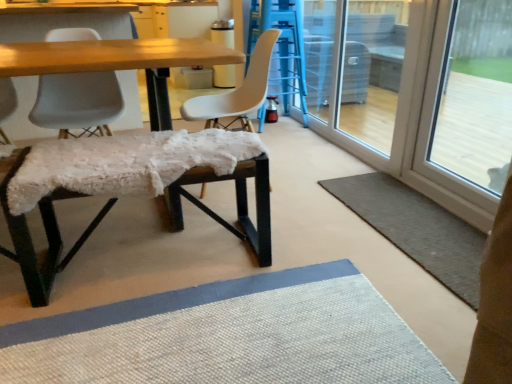
This screenshot has height=384, width=512. What do you see at coordinates (118, 62) in the screenshot? I see `wooden table at center` at bounding box center [118, 62].

Measure the distance between point [257,81] and camera.

They are 6.98 feet apart.

This screenshot has width=512, height=384. I want to click on white matte chair at center, which is counted as the second chair, starting from the left, so click(237, 92).

In order to face transparent glass door at right, should I rotate leftwards or rightwards?

A 27.451 degree turn to the right will do.

Measure the distance between point [110,93] and camera.

The distance of point [110,93] from camera is 2.37 meters.

What is the approximate width of transparent glass screen door at right?

It is 9.49 inches.

Where is `matte blue bar stool at center, arranged as the second bar stool when viewed from the front`? The width and height of the screenshot is (512, 384). matte blue bar stool at center, arranged as the second bar stool when viewed from the front is located at coordinates (281, 48).

This screenshot has height=384, width=512. In order to click on gray textured rug at lower right in this screenshot , I will do `click(416, 229)`.

Which object is further away from the camera, white matte chair at center, which is counted as the second chair, starting from the left, or white textured bench at lower left, which is the 1th chair in left-to-right order?

white textured bench at lower left, which is the 1th chair in left-to-right order.

Considering the positions of points (220, 126) and (76, 76), is point (220, 126) closer to camera compared to point (76, 76)?

Yes, point (220, 126) is in front of point (76, 76).

The width and height of the screenshot is (512, 384). In order to click on chair on the right of white textured bench at lower left, the second chair in the right-to-left sequence in this screenshot , I will do `click(237, 92)`.

Who is taller, white textured bench at lower left, the second chair in the right-to-left sequence, or matte blue bar stool at center, which is the 1th bar stool in right-to-left order?

matte blue bar stool at center, which is the 1th bar stool in right-to-left order.

Does point (104, 72) come in front of point (267, 12)?

Yes, it is.

Where is `bar stool behind the white textured bench at lower left, which is the 1th chair in left-to-right order`? The image size is (512, 384). bar stool behind the white textured bench at lower left, which is the 1th chair in left-to-right order is located at coordinates (281, 48).

Is white textured bench at lower left, the second chair in the right-to-left sequence, wider than matte blue bar stool at center, the 1th bar stool in the back-to-front sequence?

Correct, the width of white textured bench at lower left, the second chair in the right-to-left sequence, exceeds that of matte blue bar stool at center, the 1th bar stool in the back-to-front sequence.

Between white textured bench at lower left, which is the 1th chair in left-to-right order, and transparent glass door at right, which one has more height?

transparent glass door at right is taller.

Does white textured bench at lower left, the second chair in the right-to-left sequence, have a greater width compared to transparent glass door at right?

Correct, the width of white textured bench at lower left, the second chair in the right-to-left sequence, exceeds that of transparent glass door at right.

Considering the positions of objects white textured bench at lower left, which is the 1th chair in left-to-right order, and transparent glass door at right in the image provided, who is behind, white textured bench at lower left, which is the 1th chair in left-to-right order, or transparent glass door at right?

Positioned behind is white textured bench at lower left, which is the 1th chair in left-to-right order.

The height and width of the screenshot is (384, 512). Find the location of `chair in front of the white textured bench at lower left, the second chair in the right-to-left sequence`. chair in front of the white textured bench at lower left, the second chair in the right-to-left sequence is located at coordinates (237, 92).

Considering the relative sizes of white textured bench at lower left, the second chair in the right-to-left sequence, and white matte chair at center, which is the 1th chair in right-to-left order, in the image provided, is white textured bench at lower left, the second chair in the right-to-left sequence, bigger than white matte chair at center, which is the 1th chair in right-to-left order,?

No.

Between point (42, 103) and point (227, 98), which one is positioned in front?

Positioned in front is point (42, 103).

Which is more to the left, white textured bench at lower left, which is the 1th chair in left-to-right order, or white matte chair at center, which is the 1th chair in right-to-left order?

white textured bench at lower left, which is the 1th chair in left-to-right order, is more to the left.

In terms of height, does white textured bench at lower left, the second chair in the right-to-left sequence, look taller or shorter compared to transparent glass screen door at right?

Considering their sizes, white textured bench at lower left, the second chair in the right-to-left sequence, has less height than transparent glass screen door at right.

I want to click on screen door located above the white textured bench at lower left, the second chair in the right-to-left sequence (from the image's perspective), so click(x=356, y=67).

Which object is thinner, white textured bench at lower left, the second chair in the right-to-left sequence, or transparent glass screen door at right?

With smaller width is transparent glass screen door at right.

How much distance is there between white textured bench at lower left, which is the 1th chair in left-to-right order, and transparent glass screen door at right?

white textured bench at lower left, which is the 1th chair in left-to-right order, and transparent glass screen door at right are 6.85 feet apart.

Is the surface of matte blue bar stool at center, which appears as the 2th bar stool when viewed from the left, in direct contact with transparent glass screen door at right?

matte blue bar stool at center, which appears as the 2th bar stool when viewed from the left, and transparent glass screen door at right are not in contact.

Who is taller, matte blue bar stool at center, the second bar stool positioned from the bottom, or transparent glass screen door at right?

Standing taller between the two is matte blue bar stool at center, the second bar stool positioned from the bottom.

Is the position of matte blue bar stool at center, which is the 1th bar stool in right-to-left order, more distant than that of transparent glass screen door at right?

Yes, it is.

Considering the sizes of objects matte blue bar stool at center, the 1th bar stool in the back-to-front sequence, and transparent glass screen door at right in the image provided, who is thinner, matte blue bar stool at center, the 1th bar stool in the back-to-front sequence, or transparent glass screen door at right?

transparent glass screen door at right.

Which is closer, (202, 106) or (357, 131)?

The point (202, 106) is closer.

Which is more to the left, white matte chair at center, which is the 1th chair in right-to-left order, or transparent glass screen door at right?

white matte chair at center, which is the 1th chair in right-to-left order.

From a real-world perspective, is white matte chair at center, which is counted as the second chair, starting from the left, physically located above or below transparent glass screen door at right?

white matte chair at center, which is counted as the second chair, starting from the left, is situated lower than transparent glass screen door at right in the real world.

Is white matte chair at center, which is counted as the second chair, starting from the left, beside transparent glass screen door at right?

No, white matte chair at center, which is counted as the second chair, starting from the left, is not beside transparent glass screen door at right.

At what (x,y) coordinates should I click in order to perform the action: click on chair below the white textured bench at lower left, which is the 1th chair in left-to-right order (from the image's perspective). Please return your answer as a coordinate pair (x, y). The height and width of the screenshot is (384, 512). Looking at the image, I should click on (237, 92).

Image resolution: width=512 pixels, height=384 pixels. I want to click on bar stool behind the white textured bench at lower left, the second chair in the right-to-left sequence, so click(281, 48).

Based on their spatial positions, is white textured bench at lower left, which is the 1th chair in left-to-right order, or matte blue bar stool at center, the second bar stool positioned from the bottom, further from wooden table at center?

Based on the image, matte blue bar stool at center, the second bar stool positioned from the bottom, appears to be further to wooden table at center.

Estimate the real-world distances between objects in this image. Which object is closer to transparent glass door at right, white matte chair at center, which is counted as the second chair, starting from the left, or wooden table at center?

white matte chair at center, which is counted as the second chair, starting from the left, lies closer to transparent glass door at right than the other object.

Which object lies further to the anchor point transparent glass screen door at right, fuzzy fabric bench at center, the second bar stool positioned from the right, or white textured bench at lower left, the second chair in the right-to-left sequence?

white textured bench at lower left, the second chair in the right-to-left sequence, is positioned further to the anchor transparent glass screen door at right.

Based on their spatial positions, is matte blue bar stool at center, which appears as the 2th bar stool when viewed from the left, or white matte chair at center, which is the 1th chair in right-to-left order, closer to wooden table at center?

white matte chair at center, which is the 1th chair in right-to-left order, is positioned closer to the anchor wooden table at center.

Looking at the image, which one is located closer to fuzzy fabric bench at center, which is the first bar stool in bottom-to-top order, gray textured rug at lower right or white textured bench at lower left, which is the 1th chair in left-to-right order?

white textured bench at lower left, which is the 1th chair in left-to-right order, is positioned closer to the anchor fuzzy fabric bench at center, which is the first bar stool in bottom-to-top order.

Based on the photo, when comparing their distances from matte blue bar stool at center, which appears as the 2th bar stool when viewed from the left, does white matte chair at center, which is the 1th chair in right-to-left order, or gray textured rug at lower right seem closer?

Based on the image, white matte chair at center, which is the 1th chair in right-to-left order, appears to be nearer to matte blue bar stool at center, which appears as the 2th bar stool when viewed from the left.

Estimate the real-world distances between objects in this image. Which object is further from wooden table at center, transparent glass screen door at right or white matte chair at center, which is the 1th chair in right-to-left order?

transparent glass screen door at right.

Estimate the real-world distances between objects in this image. Which object is further from white matte chair at center, which is the 1th chair in right-to-left order, gray textured rug at lower right or white textured bench at lower left, which is the 1th chair in left-to-right order?

Based on the image, gray textured rug at lower right appears to be further to white matte chair at center, which is the 1th chair in right-to-left order.

The image size is (512, 384). I want to click on screen door located between wooden table at center and gray textured rug at lower right in the left-right direction, so click(x=356, y=67).

Image resolution: width=512 pixels, height=384 pixels. Find the location of `window screen between gray textured rug at lower right and matte blue bar stool at center, which is the 1th bar stool from top to bottom, from front to back`. window screen between gray textured rug at lower right and matte blue bar stool at center, which is the 1th bar stool from top to bottom, from front to back is located at coordinates (477, 95).

The height and width of the screenshot is (384, 512). Identify the location of screen door between white textured bench at lower left, the second chair in the right-to-left sequence, and transparent glass door at right, in the horizontal direction. (356, 67).

In order to click on window screen between transparent glass screen door at right and gray textured rug at lower right from top to bottom in this screenshot , I will do `click(477, 95)`.